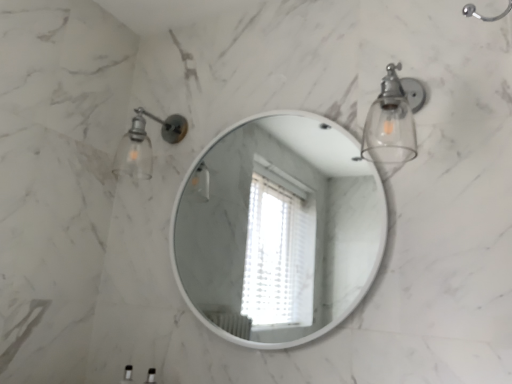
Describe the element at coordinates (145, 144) in the screenshot. This screenshot has height=384, width=512. I see `matte glass sconce at upper left, acting as the 2th light fixture starting from the right` at that location.

Where is `matte glass sconce at upper left, which is counted as the 2th light fixture, starting from the front`? The image size is (512, 384). matte glass sconce at upper left, which is counted as the 2th light fixture, starting from the front is located at coordinates (145, 144).

Can you confirm if white glossy mirror at center is wider than clear glass sconce at upper right, placed as the second light fixture when sorted from left to right?

No, white glossy mirror at center is not wider than clear glass sconce at upper right, placed as the second light fixture when sorted from left to right.

Identify the location of mirror below the clear glass sconce at upper right, the first light fixture viewed from the right (from a real-world perspective). (278, 230).

Considering the relative sizes of white glossy mirror at center and clear glass sconce at upper right, placed as the first light fixture when sorted from front to back, in the image provided, is white glossy mirror at center bigger than clear glass sconce at upper right, placed as the first light fixture when sorted from front to back,?

Yes.

Can you confirm if matte glass sconce at upper left, acting as the 2th light fixture starting from the right, is bigger than white glossy mirror at center?

Incorrect, matte glass sconce at upper left, acting as the 2th light fixture starting from the right, is not larger than white glossy mirror at center.

Which of these two, matte glass sconce at upper left, the first light fixture when ordered from left to right, or white glossy mirror at center, stands taller?

white glossy mirror at center.

Which is less distant, (143, 132) or (188, 237)?

The point (143, 132) is closer.

From a real-world perspective, who is located lower, matte glass sconce at upper left, acting as the 2th light fixture starting from the right, or white glossy mirror at center?

white glossy mirror at center.

Is white glossy mirror at center positioned far away from matte glass sconce at upper left, which is counted as the 2th light fixture, starting from the front?

Yes, white glossy mirror at center and matte glass sconce at upper left, which is counted as the 2th light fixture, starting from the front, are located far from each other.

Is white glossy mirror at center bigger or smaller than matte glass sconce at upper left, acting as the 2th light fixture starting from the right?

Clearly, white glossy mirror at center is larger in size than matte glass sconce at upper left, acting as the 2th light fixture starting from the right.

What's the angular difference between white glossy mirror at center and matte glass sconce at upper left, which is counted as the 2th light fixture, starting from the front,'s facing directions?

There is a 1.65-degree angle between the facing directions of white glossy mirror at center and matte glass sconce at upper left, which is counted as the 2th light fixture, starting from the front.

How distant is matte glass sconce at upper left, acting as the first light fixture starting from the back, from clear glass sconce at upper right, the first light fixture viewed from the right?

They are 34.39 inches apart.

Considering the sizes of objects matte glass sconce at upper left, the first light fixture when ordered from left to right, and clear glass sconce at upper right, the first light fixture viewed from the right, in the image provided, who is smaller, matte glass sconce at upper left, the first light fixture when ordered from left to right, or clear glass sconce at upper right, the first light fixture viewed from the right,?

With smaller size is matte glass sconce at upper left, the first light fixture when ordered from left to right.

Considering the positions of point (175, 128) and point (371, 150), is point (175, 128) closer or farther from the camera than point (371, 150)?

Point (175, 128) is farther from the camera than point (371, 150).

Is matte glass sconce at upper left, the first light fixture when ordered from left to right, outside of clear glass sconce at upper right, which ranks as the second light fixture in back-to-front order?

Yes, matte glass sconce at upper left, the first light fixture when ordered from left to right, is outside of clear glass sconce at upper right, which ranks as the second light fixture in back-to-front order.

From a real-world perspective, relative to white glossy mirror at center, is clear glass sconce at upper right, placed as the first light fixture when sorted from front to back, vertically above or below?

In terms of real-world spatial position, clear glass sconce at upper right, placed as the first light fixture when sorted from front to back, is above white glossy mirror at center.

Is clear glass sconce at upper right, placed as the second light fixture when sorted from left to right, not within white glossy mirror at center?

Yes, clear glass sconce at upper right, placed as the second light fixture when sorted from left to right, is not within white glossy mirror at center.

How different are the orientations of clear glass sconce at upper right, placed as the first light fixture when sorted from front to back, and white glossy mirror at center in degrees?

The facing directions of clear glass sconce at upper right, placed as the first light fixture when sorted from front to back, and white glossy mirror at center are 1.65 degrees apart.

From the image's perspective, relative to white glossy mirror at center, is clear glass sconce at upper right, the first light fixture viewed from the right, above or below?

clear glass sconce at upper right, the first light fixture viewed from the right, is above white glossy mirror at center.

Would you say clear glass sconce at upper right, placed as the second light fixture when sorted from left to right, is outside matte glass sconce at upper left, which is counted as the 2th light fixture, starting from the front?

Yes, clear glass sconce at upper right, placed as the second light fixture when sorted from left to right, is not within matte glass sconce at upper left, which is counted as the 2th light fixture, starting from the front.

Between clear glass sconce at upper right, placed as the second light fixture when sorted from left to right, and matte glass sconce at upper left, the first light fixture when ordered from left to right, which one has larger size?

Bigger between the two is clear glass sconce at upper right, placed as the second light fixture when sorted from left to right.

From a real-world perspective, which object stands above the other?

matte glass sconce at upper left, acting as the first light fixture starting from the back, from a real-world perspective.

Relative to matte glass sconce at upper left, acting as the first light fixture starting from the back, is clear glass sconce at upper right, placed as the second light fixture when sorted from left to right, in front or behind?

In the image, clear glass sconce at upper right, placed as the second light fixture when sorted from left to right, appears in front of matte glass sconce at upper left, acting as the first light fixture starting from the back.

Locate an element on the screen. The image size is (512, 384). mirror below the clear glass sconce at upper right, placed as the second light fixture when sorted from left to right (from the image's perspective) is located at coordinates (278, 230).

Find the location of a particular element. mirror in front of the matte glass sconce at upper left, the first light fixture when ordered from left to right is located at coordinates (278, 230).

Which object lies nearer to the anchor point matte glass sconce at upper left, acting as the first light fixture starting from the back, white glossy mirror at center or clear glass sconce at upper right, placed as the first light fixture when sorted from front to back?

clear glass sconce at upper right, placed as the first light fixture when sorted from front to back, lies closer to matte glass sconce at upper left, acting as the first light fixture starting from the back, than the other object.

When comparing their distances from matte glass sconce at upper left, acting as the 2th light fixture starting from the right, does clear glass sconce at upper right, placed as the first light fixture when sorted from front to back, or white glossy mirror at center seem closer?

clear glass sconce at upper right, placed as the first light fixture when sorted from front to back.

Based on their spatial positions, is clear glass sconce at upper right, the first light fixture viewed from the right, or matte glass sconce at upper left, acting as the 2th light fixture starting from the right, further from white glossy mirror at center?

clear glass sconce at upper right, the first light fixture viewed from the right, lies further to white glossy mirror at center than the other object.

Considering their positions, is matte glass sconce at upper left, which is counted as the 2th light fixture, starting from the front, positioned further to white glossy mirror at center than clear glass sconce at upper right, placed as the second light fixture when sorted from left to right?

Based on the image, clear glass sconce at upper right, placed as the second light fixture when sorted from left to right, appears to be further to white glossy mirror at center.

Estimate the real-world distances between objects in this image. Which object is closer to clear glass sconce at upper right, placed as the second light fixture when sorted from left to right, white glossy mirror at center or matte glass sconce at upper left, acting as the 2th light fixture starting from the right?

matte glass sconce at upper left, acting as the 2th light fixture starting from the right, lies closer to clear glass sconce at upper right, placed as the second light fixture when sorted from left to right, than the other object.

Looking at the image, which one is located closer to clear glass sconce at upper right, placed as the first light fixture when sorted from front to back, matte glass sconce at upper left, acting as the first light fixture starting from the back, or white glossy mirror at center?

matte glass sconce at upper left, acting as the first light fixture starting from the back, is closer to clear glass sconce at upper right, placed as the first light fixture when sorted from front to back.

You are a GUI agent. You are given a task and a screenshot of the screen. Output one action in this format:
    pyautogui.click(x=<x>, y=<y>)
    Task: Click on the mirror located between matte glass sconce at upper left, acting as the 2th light fixture starting from the right, and clear glass sconce at upper right, placed as the second light fixture when sorted from left to right, in the left-right direction
    Image resolution: width=512 pixels, height=384 pixels.
    Given the screenshot: What is the action you would take?
    pyautogui.click(x=278, y=230)